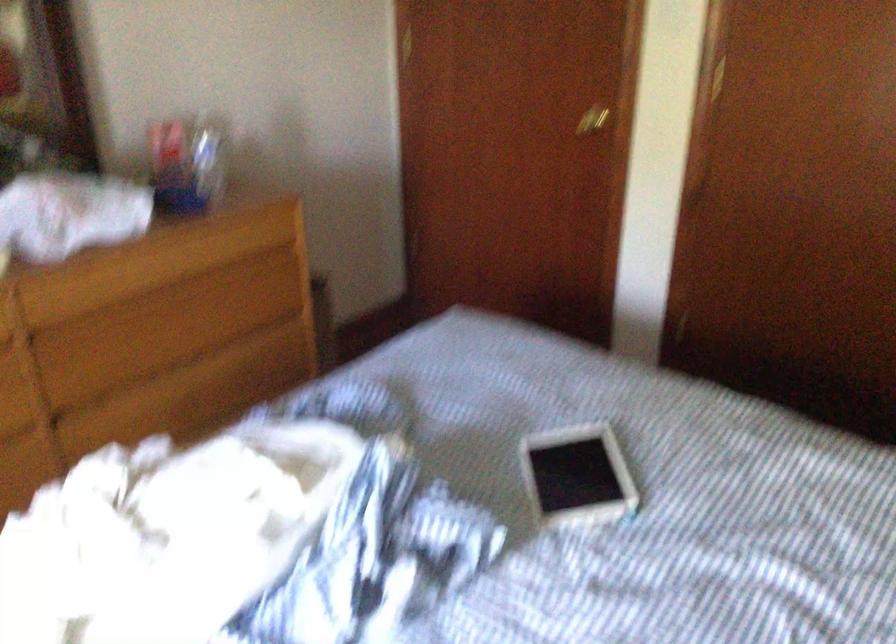
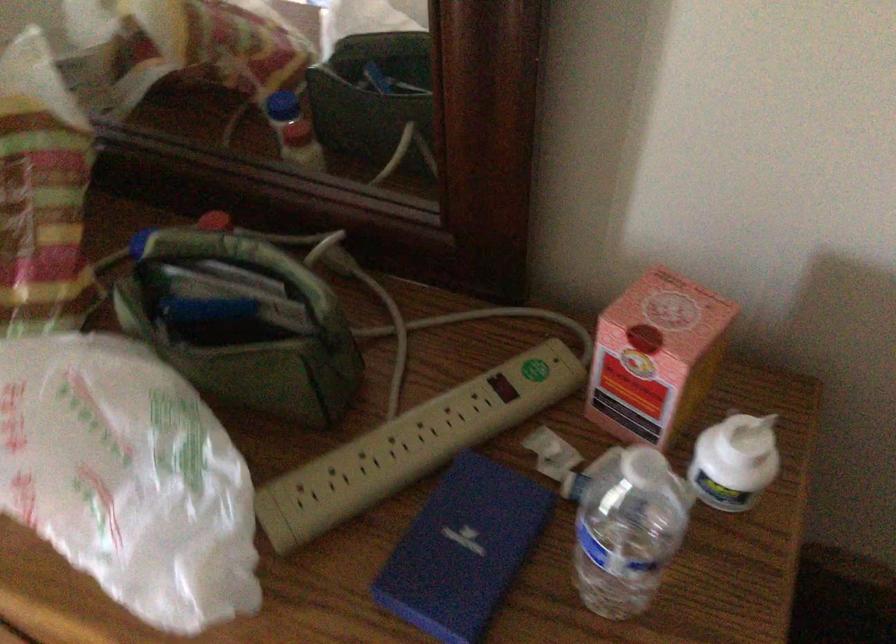
In the second image, find the point that corresponds to the point at 209,158 in the first image.

(735, 462)